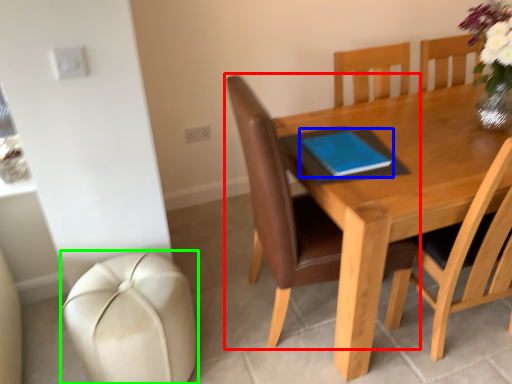
Question: Which object is positioned closest to chair (highlighted by a red box)? Select from notebook (highlighted by a blue box) and swivel chair (highlighted by a green box).

Choices:
 (A) notebook
 (B) swivel chair

Answer: (A)